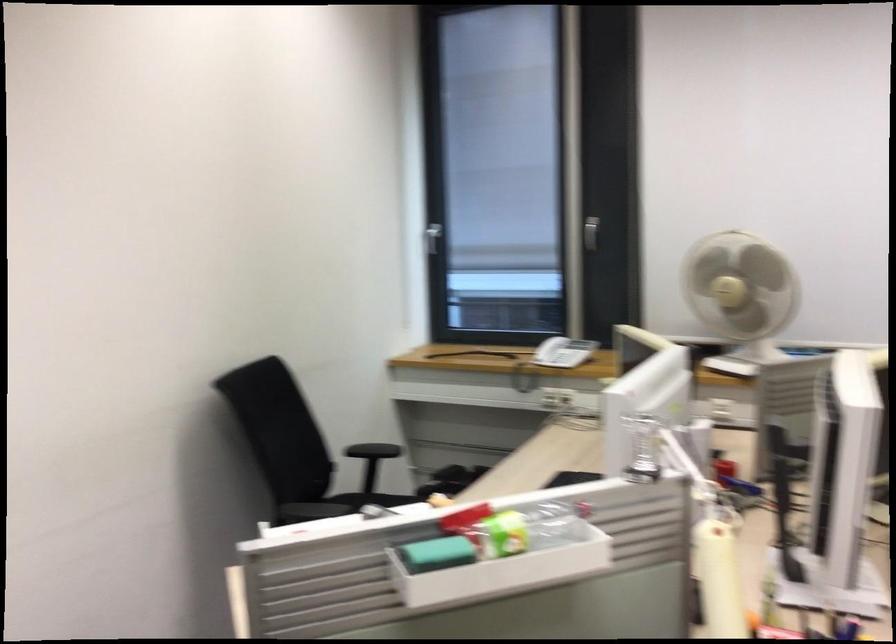
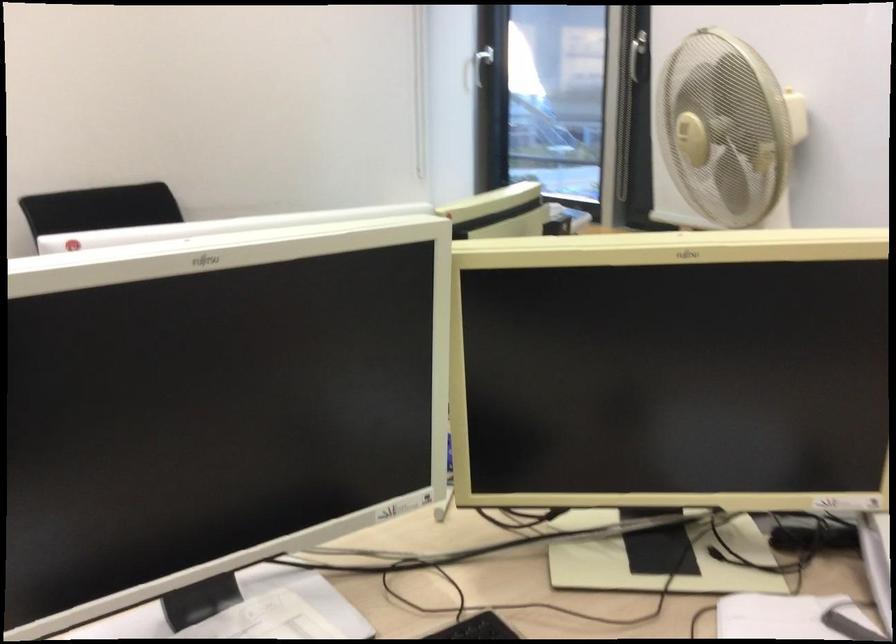
Where in the second image is the point corresponding to point (416, 230) from the first image?

(476, 69)